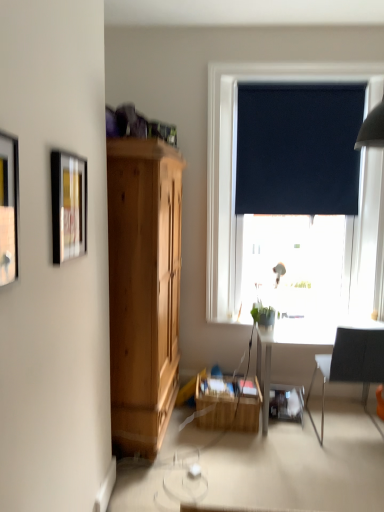
Measure the distance between black roller blind at upper right and camera.

black roller blind at upper right and camera are 3.21 meters apart from each other.

Describe the element at coordinates (351, 365) in the screenshot. I see `black fabric chair at right` at that location.

Locate an element on the screen. The width and height of the screenshot is (384, 512). metallic silver picture frame at upper left, which is counted as the first picture frame, starting from the back is located at coordinates (68, 205).

The width and height of the screenshot is (384, 512). Find the location of `table below the matte black picture frame at left, the second picture frame from the back (from the image's perspective)`. table below the matte black picture frame at left, the second picture frame from the back (from the image's perspective) is located at coordinates (229, 410).

Consider the image. Is there a large distance between matte black picture frame at left, the second picture frame from the back, and wooden crate at center?

Yes, matte black picture frame at left, the second picture frame from the back, and wooden crate at center are quite far apart.

Is matte black picture frame at left, the second picture frame from the back, facing away from wooden crate at center?

No, matte black picture frame at left, the second picture frame from the back,'s orientation is not away from wooden crate at center.

Which object is positioned more to the left, matte black picture frame at left, the second picture frame from the back, or wooden crate at center?

Positioned to the left is matte black picture frame at left, the second picture frame from the back.

Are black fabric chair at right and black roller blind at upper right located far from each other?

Yes, black fabric chair at right is far from black roller blind at upper right.

From the image's perspective, does black fabric chair at right appear lower than black roller blind at upper right?

Yes, from the image's perspective, black fabric chair at right is beneath black roller blind at upper right.

Is black fabric chair at right positioned with its back to black roller blind at upper right?

No.

In the image, is black fabric chair at right positioned in front of or behind black roller blind at upper right?

Clearly, black fabric chair at right is in front of black roller blind at upper right.

Is green matte plant at lower center not near black fabric chair at right?

No, green matte plant at lower center is not far away from black fabric chair at right.

From the image's perspective, relative to black fabric chair at right, is green matte plant at lower center above or below?

Clearly, from the image's perspective, green matte plant at lower center is above black fabric chair at right.

Is green matte plant at lower center further to the viewer compared to black fabric chair at right?

Yes, green matte plant at lower center is behind black fabric chair at right.

Is green matte plant at lower center facing towards black fabric chair at right?

No, green matte plant at lower center is not facing towards black fabric chair at right.

Can we say metallic silver picture frame at upper left, which is counted as the first picture frame, starting from the back, lies outside green matte plant at lower center?

Absolutely, metallic silver picture frame at upper left, which is counted as the first picture frame, starting from the back, is external to green matte plant at lower center.

Is metallic silver picture frame at upper left, which is counted as the first picture frame, starting from the back, positioned with its back to green matte plant at lower center?

No, metallic silver picture frame at upper left, which is counted as the first picture frame, starting from the back, is not facing away from green matte plant at lower center.

Which is in front, metallic silver picture frame at upper left, which is counted as the second picture frame, starting from the front, or green matte plant at lower center?

Positioned in front is metallic silver picture frame at upper left, which is counted as the second picture frame, starting from the front.

Locate an element on the screen. window lying above the green matte plant at lower center (from the image's perspective) is located at coordinates (234, 161).

Based on the photo, from the image's perspective, between black roller blind at upper right and green matte plant at lower center, who is located below?

green matte plant at lower center appears lower in the image.

From a real-world perspective, is black roller blind at upper right located higher than green matte plant at lower center?

Indeed, from a real-world perspective, black roller blind at upper right stands above green matte plant at lower center.

Considering the positions of points (381, 65) and (254, 318), is point (381, 65) farther from camera compared to point (254, 318)?

Yes.

This screenshot has width=384, height=512. What are the coordinates of `table below the green matte plant at lower center (from the image's perspective)` in the screenshot? It's located at (229, 410).

Would you consider green matte plant at lower center to be distant from wooden crate at center?

No, there isn't a large distance between green matte plant at lower center and wooden crate at center.

From a real-world perspective, is green matte plant at lower center under wooden crate at center?

No, from a real-world perspective, green matte plant at lower center is not beneath wooden crate at center.

Is metallic silver picture frame at upper left, which is counted as the second picture frame, starting from the front, a part of black fabric curtain at upper right?

No, metallic silver picture frame at upper left, which is counted as the second picture frame, starting from the front, is not a part of black fabric curtain at upper right.

Is black fabric curtain at upper right oriented away from metallic silver picture frame at upper left, which is counted as the first picture frame, starting from the back?

No, black fabric curtain at upper right is not facing away from metallic silver picture frame at upper left, which is counted as the first picture frame, starting from the back.

From a real-world perspective, who is located higher, black fabric curtain at upper right or metallic silver picture frame at upper left, which is counted as the first picture frame, starting from the back?

black fabric curtain at upper right.

Are black fabric curtain at upper right and metallic silver picture frame at upper left, which is counted as the second picture frame, starting from the front, located far from each other?

That's right, there is a large distance between black fabric curtain at upper right and metallic silver picture frame at upper left, which is counted as the second picture frame, starting from the front.

In order to click on table behind the matte black picture frame at left, the second picture frame from the back in this screenshot , I will do `click(229, 410)`.

The height and width of the screenshot is (512, 384). In the image, there is a black roller blind at upper right. In order to click on chair below it (from a real-world perspective) in this screenshot , I will do `click(351, 365)`.

From the image, which object appears to be nearer to black fabric chair at right, metallic silver picture frame at upper left, which is counted as the second picture frame, starting from the front, or black roller blind at upper right?

black roller blind at upper right.

When comparing their distances from green matte plant at lower center, does black fabric curtain at upper right or black fabric chair at right seem further?

Among the two, black fabric curtain at upper right is located further to green matte plant at lower center.

When comparing their distances from matte black picture frame at left, the second picture frame from the back, does metallic silver picture frame at upper left, which is counted as the first picture frame, starting from the back, or black fabric curtain at upper right seem further?

black fabric curtain at upper right.

Looking at the image, which one is located closer to matte black picture frame at left, the second picture frame from the back, black roller blind at upper right or metallic silver picture frame at upper left, which is counted as the second picture frame, starting from the front?

metallic silver picture frame at upper left, which is counted as the second picture frame, starting from the front, is positioned closer to the anchor matte black picture frame at left, the second picture frame from the back.

Considering their positions, is black fabric chair at right positioned further to black roller blind at upper right than matte black picture frame at left, positioned as the 1th picture frame in front-to-back order?

matte black picture frame at left, positioned as the 1th picture frame in front-to-back order, is positioned further to the anchor black roller blind at upper right.

Consider the image. Estimate the real-world distances between objects in this image. Which object is closer to black fabric chair at right, wooden crate at center or metallic silver picture frame at upper left, which is counted as the first picture frame, starting from the back?

wooden crate at center lies closer to black fabric chair at right than the other object.

Looking at the image, which one is located closer to black fabric chair at right, green matte plant at lower center or black roller blind at upper right?

green matte plant at lower center is closer to black fabric chair at right.

Considering their positions, is matte black picture frame at left, the second picture frame from the back, positioned further to metallic silver picture frame at upper left, which is counted as the second picture frame, starting from the front, than green matte plant at lower center?

green matte plant at lower center.

You are a GUI agent. You are given a task and a screenshot of the screen. Output one action in this format:
    pyautogui.click(x=<x>, y=<y>)
    Task: Click on the houseplant between metallic silver picture frame at upper left, which is counted as the second picture frame, starting from the front, and wooden crate at center in the front-back direction
    The height and width of the screenshot is (512, 384).
    Given the screenshot: What is the action you would take?
    pyautogui.click(x=263, y=315)

Locate an element on the screen. This screenshot has height=512, width=384. chair between black roller blind at upper right and wooden crate at center in the up-down direction is located at coordinates (351, 365).

Where is `chair between metallic silver picture frame at upper left, which is counted as the second picture frame, starting from the front, and black fabric curtain at upper right, along the z-axis`? This screenshot has width=384, height=512. chair between metallic silver picture frame at upper left, which is counted as the second picture frame, starting from the front, and black fabric curtain at upper right, along the z-axis is located at coordinates (351, 365).

At what (x,y) coordinates should I click in order to perform the action: click on picture frame between matte black picture frame at left, the second picture frame from the back, and black fabric curtain at upper right, along the z-axis. Please return your answer as a coordinate pair (x, y). Looking at the image, I should click on (68, 205).